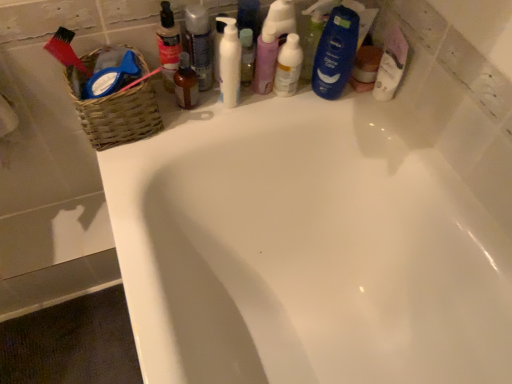
At what (x,y) coordinates should I click in order to perform the action: click on spots to the right of white matte pump bottle at upper center. Please return your answer as a coordinate pair (x, y). The image size is (512, 384). Looking at the image, I should click on (281, 108).